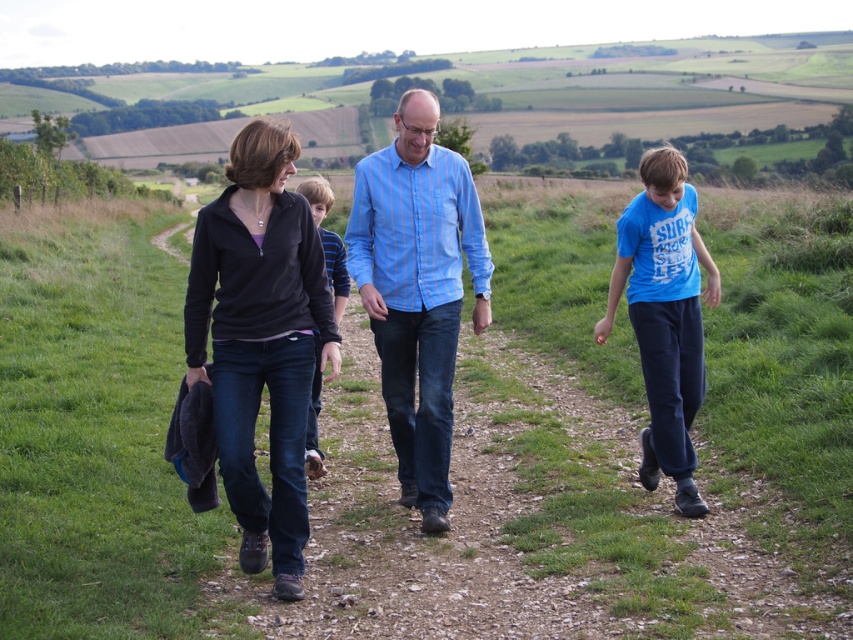
You are a hiker planning to walk along the path shown in the scene. You see a matte black jacket at left located at point (x=416, y=289). If you start walking from the center of the path, which direction should you turn to reach the matte black jacket at left?

To reach the matte black jacket at left located at point (x=416, y=289) from the center of the path, you should turn to the left since the jacket is positioned to the left side of the path.